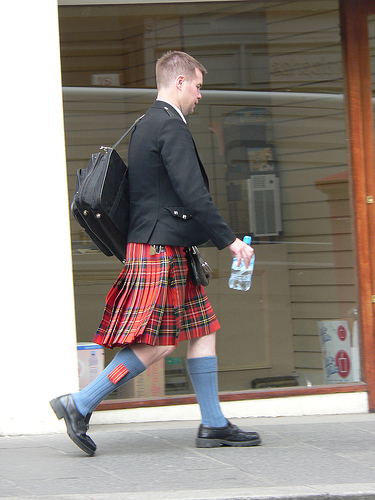
Find the location of `shoe`. shoe is located at coordinates (75, 426), (227, 437).